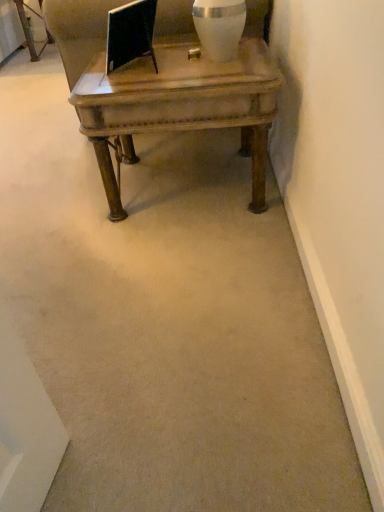
Question: Would you say wooden coffee table at center is to the left or to the right of white glossy vase at upper center in the picture?

Choices:
 (A) left
 (B) right

Answer: (A)

Question: Looking at their shapes, would you say wooden coffee table at center is wider or thinner than white glossy vase at upper center?

Choices:
 (A) thin
 (B) wide

Answer: (B)

Question: Relative to white glossy vase at upper center, is wooden coffee table at center in front or behind?

Choices:
 (A) front
 (B) behind

Answer: (A)

Question: From their relative heights in the image, would you say white glossy vase at upper center is taller or shorter than wooden coffee table at center?

Choices:
 (A) short
 (B) tall

Answer: (A)

Question: In the image, is white glossy vase at upper center positioned in front of or behind wooden coffee table at center?

Choices:
 (A) behind
 (B) front

Answer: (A)

Question: Is point (218, 49) closer or farther from the camera than point (223, 66)?

Choices:
 (A) closer
 (B) farther

Answer: (A)

Question: In the image, is white glossy vase at upper center on the left side or the right side of wooden coffee table at center?

Choices:
 (A) right
 (B) left

Answer: (A)